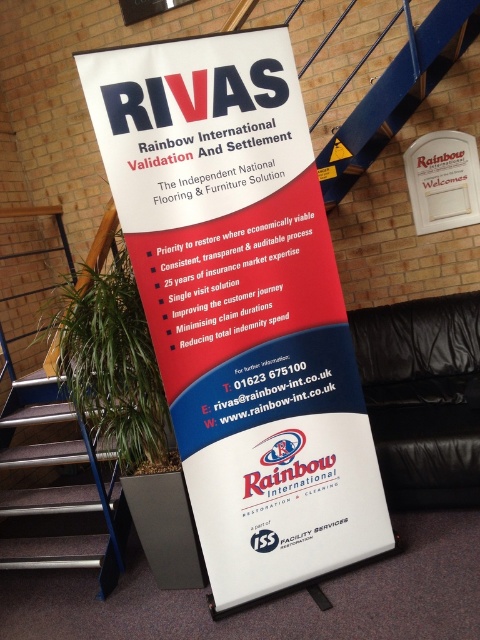
You are standing at the bottom of the brown carpeted stairs at lower left and want to read the white paper poster at center. Which direction should you move to reach the poster?

The white paper poster at center is positioned on the right side of brown carpeted stairs at lower left. Therefore, you should move to your right to reach the white paper poster at center.

You are a delivery person holding a 1.2 meter long wooden box. You are standing in front of the white paper poster at center and want to move it to the brown carpeted stairs at lower left. Can you move the box horizontally without tilting it?

The distance between the white paper poster at center and brown carpeted stairs at lower left is 1.35 meters. Since the box is 1.2 meters long, it can be moved horizontally without tilting as there is enough space.